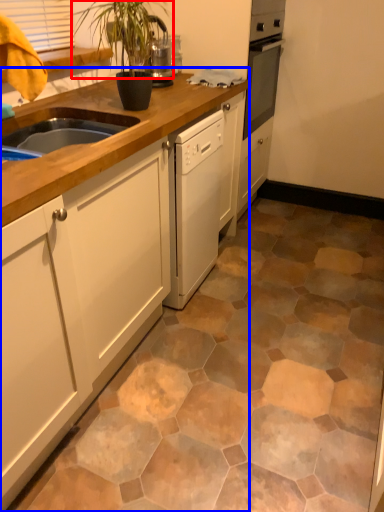
Question: Among these objects, which one is nearest to the camera, plant (highlighted by a red box) or cabinetry (highlighted by a blue box)?

Choices:
 (A) plant
 (B) cabinetry

Answer: (B)